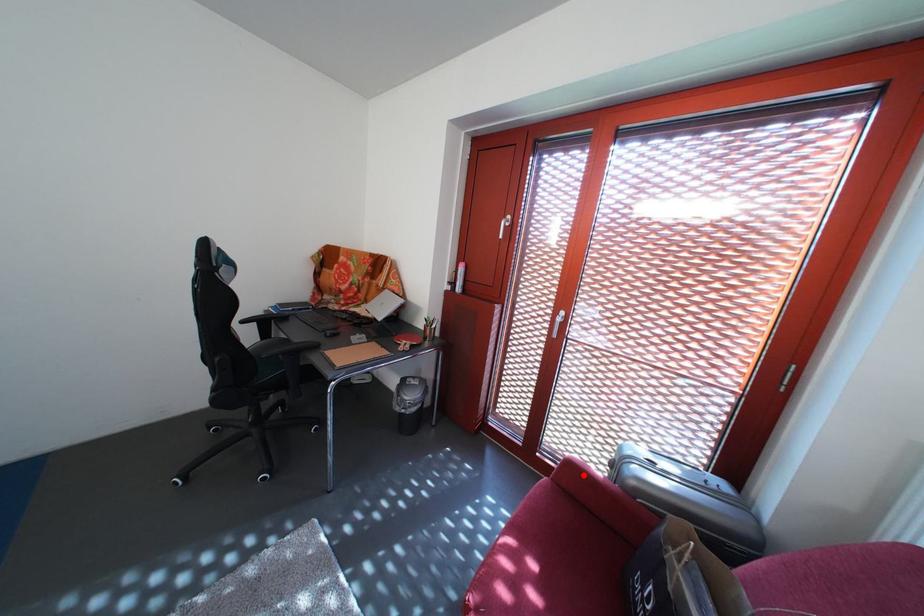
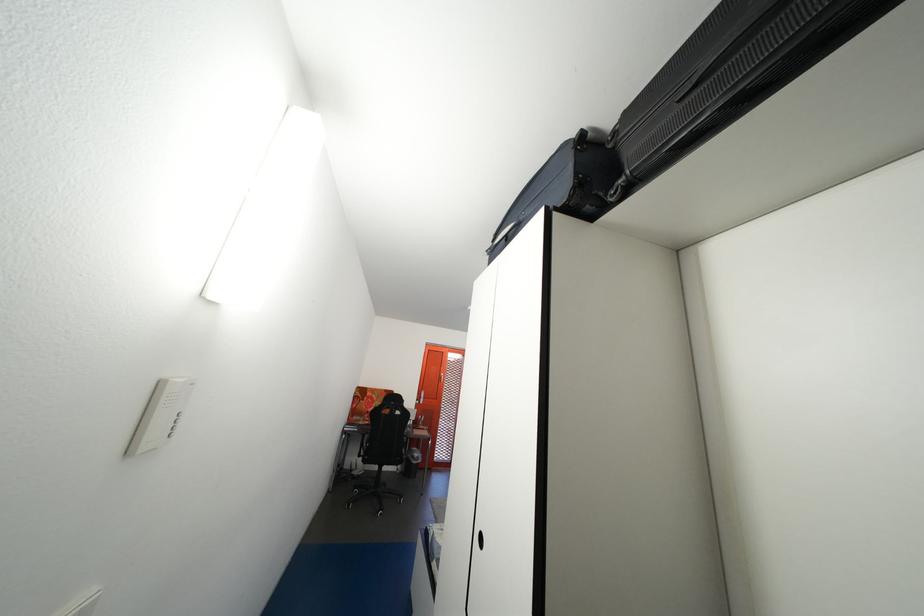
Question: I am providing you with two images of the same scene from different viewpoints. A red point is marked on the first image. Is the red point's position out of view in image 2?

Choices:
 (A) Yes
 (B) No

Answer: (A)